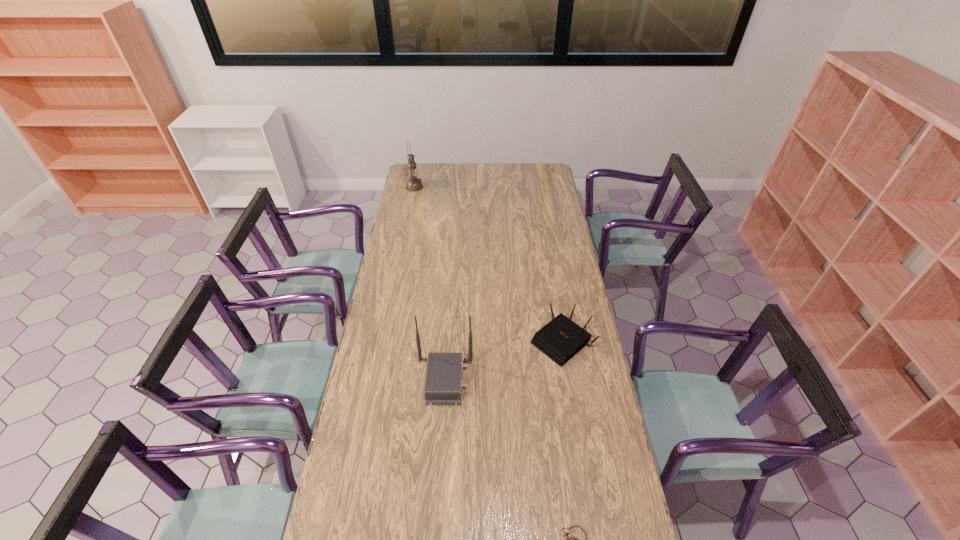
Image resolution: width=960 pixels, height=540 pixels. What are the coordinates of `the leftmost object` in the screenshot? It's located at pos(413,184).

You are a GUI agent. You are given a task and a screenshot of the screen. Output one action in this format:
    pyautogui.click(x=<x>, y=<y>)
    Task: Click on the oil lamp
    This screenshot has height=540, width=960.
    Given the screenshot: What is the action you would take?
    pyautogui.click(x=413, y=184)

I want to click on the third object from right to left, so click(x=443, y=385).

Locate an element on the screen. Image resolution: width=960 pixels, height=540 pixels. the taller router is located at coordinates (443, 385).

Image resolution: width=960 pixels, height=540 pixels. In order to click on the shorter router in this screenshot , I will do `click(560, 339)`.

At what (x,y) coordinates should I click in order to perform the action: click on the right router. Please return your answer as a coordinate pair (x, y). This screenshot has width=960, height=540. Looking at the image, I should click on (560, 339).

This screenshot has width=960, height=540. What are the coordinates of `vacant space situated on the back of the farthest object` in the screenshot? It's located at (419, 163).

Locate an element on the screen. vacant area situated 0.170m on the back of the left router to connect cables is located at coordinates (517, 380).

Where is `free space located on the front of the second shortest object`? The image size is (960, 540). free space located on the front of the second shortest object is located at coordinates (576, 430).

The image size is (960, 540). What are the coordinates of `object that is at the far edge` in the screenshot? It's located at (413, 184).